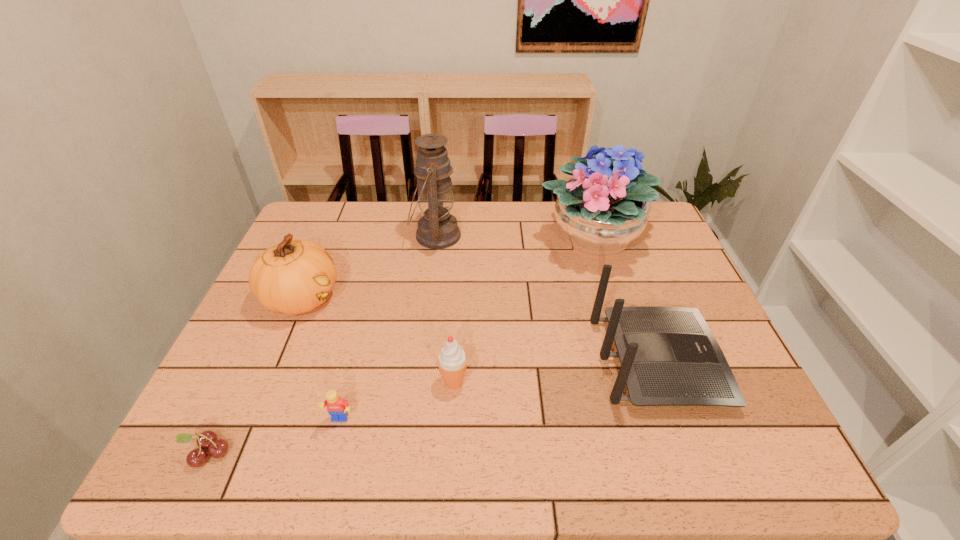
Find the location of a particular element. This screenshot has height=540, width=960. bouquet at the right edge is located at coordinates (599, 214).

In order to click on router at the right edge in this screenshot , I will do `click(669, 356)`.

Find the location of `object located in the near left corner section of the desktop`. object located in the near left corner section of the desktop is located at coordinates click(208, 439).

Where is `object situated at the far right corner`? The height and width of the screenshot is (540, 960). object situated at the far right corner is located at coordinates (599, 214).

This screenshot has width=960, height=540. In the image, there is a desktop. In order to click on vacant space at the far edge in this screenshot , I will do `click(543, 211)`.

You are a GUI agent. You are given a task and a screenshot of the screen. Output one action in this format:
    pyautogui.click(x=<x>, y=<y>)
    Task: Click on the free space at the near edge of the desktop
    Image resolution: width=960 pixels, height=540 pixels.
    Given the screenshot: What is the action you would take?
    pyautogui.click(x=398, y=433)

Identify the location of vacant space at the left edge of the desktop. (252, 312).

In the image, there is a desktop. Where is `free space at the right edge`? The height and width of the screenshot is (540, 960). free space at the right edge is located at coordinates (626, 251).

The height and width of the screenshot is (540, 960). I want to click on vacant space at the far left corner of the desktop, so pyautogui.click(x=315, y=213).

Where is `vacant space at the near right corner of the desktop`? This screenshot has height=540, width=960. vacant space at the near right corner of the desktop is located at coordinates (768, 463).